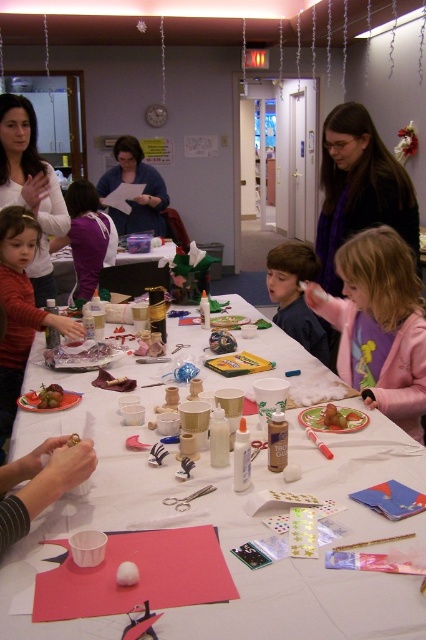
Is point (25, 301) positioned behind point (340, 412)?

Yes, it is behind point (340, 412).

From the picture: Is matte red sweater at center smaller than smooth chocolate cake at lower center?

No, matte red sweater at center is not smaller than smooth chocolate cake at lower center.

What do you see at coordinates (20, 308) in the screenshot? I see `matte red sweater at center` at bounding box center [20, 308].

Locate an element on the screen. matte red sweater at center is located at coordinates (20, 308).

Is purple scarf at upper right below matte blue sweater at upper center?

Correct, purple scarf at upper right is located below matte blue sweater at upper center.

Which is behind, point (403, 237) or point (155, 173)?

The point (155, 173) is behind.

Is point (324, 161) more distant than point (124, 230)?

No, (324, 161) is in front of (124, 230).

Locate an element on the screen. purple scarf at upper right is located at coordinates (359, 188).

Who is more forward, (x=359, y=476) or (x=163, y=220)?

Point (x=359, y=476) is in front.

I want to click on white paper at center, so click(x=227, y=529).